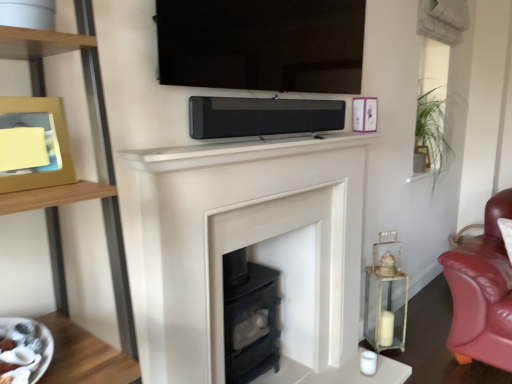
Question: Can you confirm if wooden picture frame at left, which is counted as the 1th picture frame, starting from the bottom, is taller than clear glass lantern at right?

Choices:
 (A) yes
 (B) no

Answer: (B)

Question: Does wooden picture frame at left, the 2th picture frame positioned from the right, have a smaller size compared to clear glass lantern at right?

Choices:
 (A) no
 (B) yes

Answer: (B)

Question: From a real-world perspective, is wooden picture frame at left, the 1th picture frame from the front, physically above clear glass lantern at right?

Choices:
 (A) yes
 (B) no

Answer: (A)

Question: From the image's perspective, is wooden picture frame at left, which is counted as the 1th picture frame, starting from the bottom, above clear glass lantern at right?

Choices:
 (A) no
 (B) yes

Answer: (B)

Question: Does wooden picture frame at left, the 2th picture frame positioned from the right, have a greater width compared to clear glass lantern at right?

Choices:
 (A) yes
 (B) no

Answer: (B)

Question: Is wooden picture frame at left, which is counted as the 1th picture frame, starting from the bottom, surrounding clear glass lantern at right?

Choices:
 (A) yes
 (B) no

Answer: (B)

Question: Is white glossy plate at lower left to the left of metallic purple picture frame at upper right, arranged as the second picture frame when viewed from the front, from the viewer's perspective?

Choices:
 (A) yes
 (B) no

Answer: (A)

Question: Is white glossy plate at lower left at the right side of metallic purple picture frame at upper right, acting as the 1th picture frame starting from the right?

Choices:
 (A) no
 (B) yes

Answer: (A)

Question: Is metallic purple picture frame at upper right, the 2th picture frame from the left, at the back of white glossy plate at lower left?

Choices:
 (A) no
 (B) yes

Answer: (A)

Question: Is there a large distance between white glossy plate at lower left and metallic purple picture frame at upper right, marked as the second picture frame in a bottom-to-top arrangement?

Choices:
 (A) no
 (B) yes

Answer: (B)

Question: From the image's perspective, does white glossy plate at lower left appear higher than metallic purple picture frame at upper right, the 2th picture frame from the left?

Choices:
 (A) yes
 (B) no

Answer: (B)

Question: Considering the relative sizes of white glossy plate at lower left and metallic purple picture frame at upper right, acting as the 1th picture frame starting from the right, in the image provided, is white glossy plate at lower left thinner than metallic purple picture frame at upper right, acting as the 1th picture frame starting from the right,?

Choices:
 (A) yes
 (B) no

Answer: (B)

Question: Considering the relative sizes of green leafy plant at upper right and clear glass lantern at right in the image provided, is green leafy plant at upper right smaller than clear glass lantern at right?

Choices:
 (A) yes
 (B) no

Answer: (B)